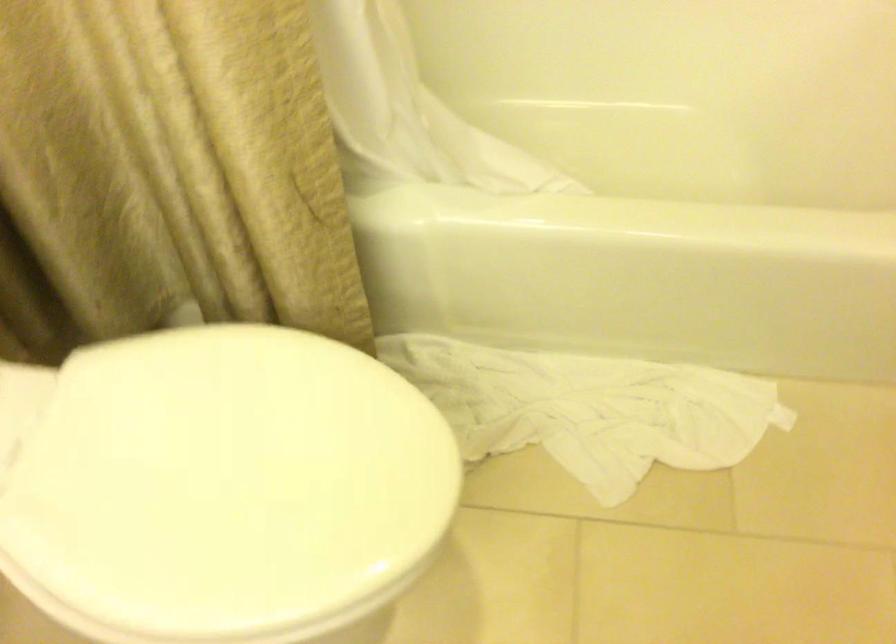
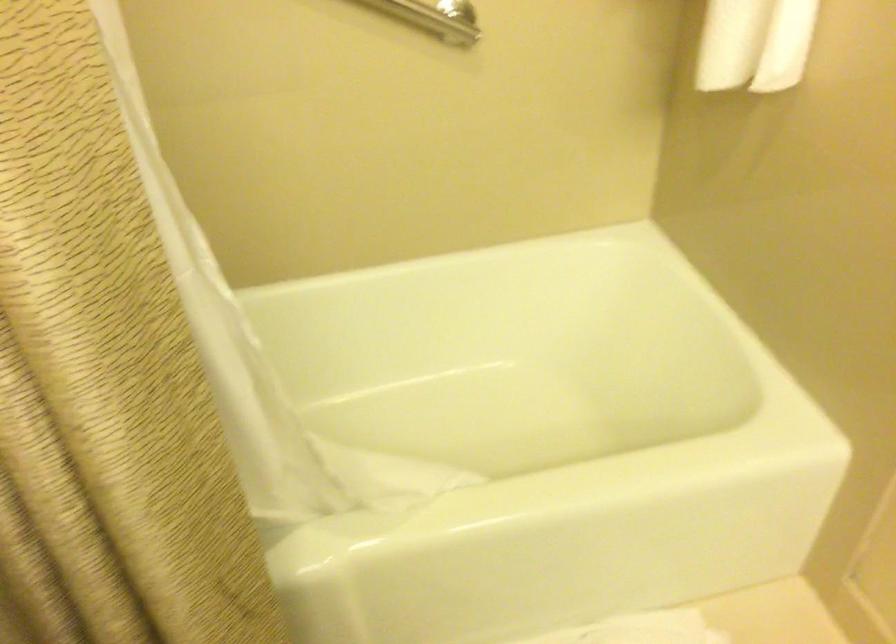
How did the camera likely rotate?

The rotation direction of the camera is right-up.